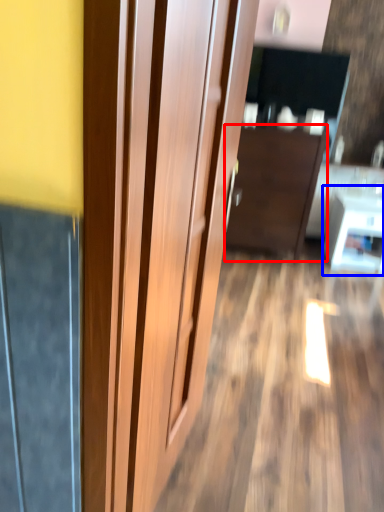
Question: Which point is further to the camera, furniture (highlighted by a red box) or table (highlighted by a blue box)?

Choices:
 (A) furniture
 (B) table

Answer: (B)